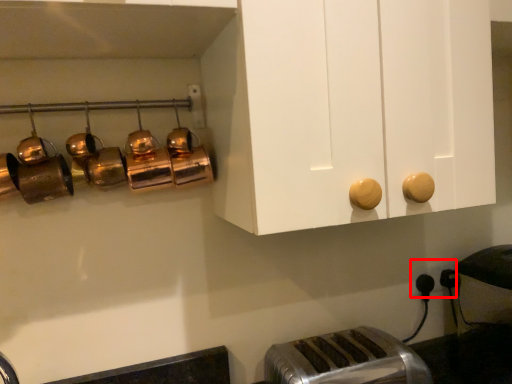
Question: Where is electric outlet (annotated by the red box) located in relation to toaster in the image?

Choices:
 (A) left
 (B) right

Answer: (B)